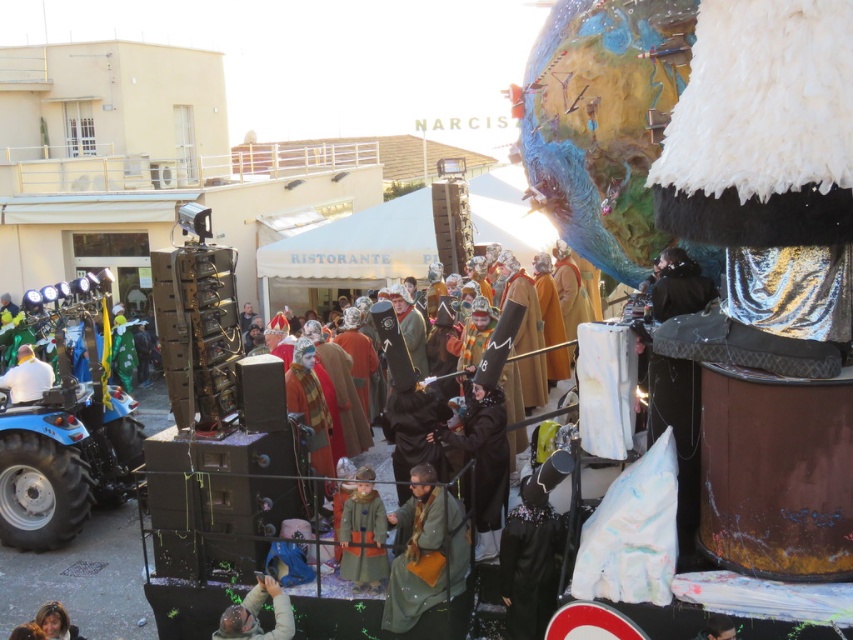
You are a participant in the parade and need to locate your costume pieces. You see the green matte coat at center and the matte black helmet at lower center. Which item is positioned to the right of the other?

The green matte coat at center is to the right of the matte black helmet at lower center.

You are organizing a costume party and need to arrange two outfits on a display rack. The green wool coat at center and the white matte shirt at lower left must be placed side by side. Which outfit should you place first if you want the wider item to be on the left side of the rack?

The white matte shirt at lower left should be placed first on the left side of the rack because its width is greater than the green wool coat at center.